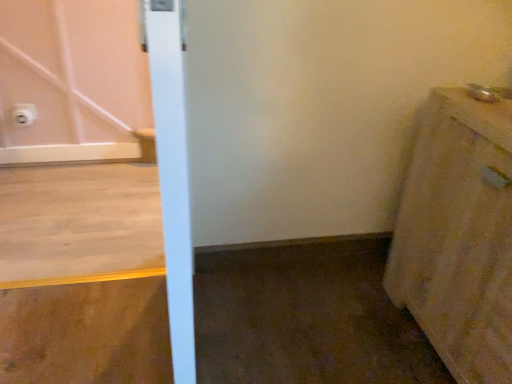
The width and height of the screenshot is (512, 384). What are the coordinates of `white plastic electric outlet at upper left` in the screenshot? It's located at (24, 114).

The height and width of the screenshot is (384, 512). What do you see at coordinates (24, 114) in the screenshot?
I see `white plastic electric outlet at upper left` at bounding box center [24, 114].

What do you see at coordinates (458, 235) in the screenshot? I see `beige fabric cabinet at right` at bounding box center [458, 235].

Where is `beige fabric cabinet at right`? The width and height of the screenshot is (512, 384). beige fabric cabinet at right is located at coordinates (458, 235).

Locate an element on the screen. This screenshot has width=512, height=384. white plastic electric outlet at upper left is located at coordinates (24, 114).

Does beige fabric cabinet at right appear on the left side of white plastic electric outlet at upper left?

Incorrect, beige fabric cabinet at right is not on the left side of white plastic electric outlet at upper left.

Is beige fabric cabinet at right further to the viewer compared to white plastic electric outlet at upper left?

No, it is not.

Does point (502, 228) appear closer or farther from the camera than point (31, 108)?

Point (502, 228).

From the image's perspective, is beige fabric cabinet at right positioned above or below white plastic electric outlet at upper left?

Based on their image positions, beige fabric cabinet at right is located beneath white plastic electric outlet at upper left.

From a real-world perspective, which is physically above, beige fabric cabinet at right or white plastic electric outlet at upper left?

From a 3D spatial view, beige fabric cabinet at right is above.

Between beige fabric cabinet at right and white plastic electric outlet at upper left, which one has smaller width?

white plastic electric outlet at upper left.

Considering the sizes of objects beige fabric cabinet at right and white plastic electric outlet at upper left in the image provided, who is taller, beige fabric cabinet at right or white plastic electric outlet at upper left?

beige fabric cabinet at right is taller.

Is beige fabric cabinet at right bigger than white plastic electric outlet at upper left?

Indeed, beige fabric cabinet at right has a larger size compared to white plastic electric outlet at upper left.

Is beige fabric cabinet at right completely or partially outside of white plastic electric outlet at upper left?

Yes, beige fabric cabinet at right is located beyond the bounds of white plastic electric outlet at upper left.

Is beige fabric cabinet at right not close to white plastic electric outlet at upper left?

beige fabric cabinet at right is positioned a significant distance from white plastic electric outlet at upper left.

Is white plastic electric outlet at upper left at the back of beige fabric cabinet at right?

beige fabric cabinet at right does not have its back to white plastic electric outlet at upper left.

How different are the orientations of beige fabric cabinet at right and white plastic electric outlet at upper left in degrees?

They differ by 89.1 degrees in their facing directions.

Identify the location of cabinetry located below the white plastic electric outlet at upper left (from the image's perspective). (458, 235).

Between white plastic electric outlet at upper left and beige fabric cabinet at right, which one appears on the left side from the viewer's perspective?

white plastic electric outlet at upper left is more to the left.

In the scene shown: Is white plastic electric outlet at upper left positioned before beige fabric cabinet at right?

No, it is not.

Which is closer, (30, 116) or (417, 220)?

Point (30, 116).

From the image's perspective, would you say white plastic electric outlet at upper left is shown under beige fabric cabinet at right?

No.

Looking at this image, from a real-world perspective, is white plastic electric outlet at upper left under beige fabric cabinet at right?

Indeed, from a real-world perspective, white plastic electric outlet at upper left is positioned beneath beige fabric cabinet at right.

Which of these two, white plastic electric outlet at upper left or beige fabric cabinet at right, is wider?

beige fabric cabinet at right.

Can you confirm if white plastic electric outlet at upper left is taller than beige fabric cabinet at right?

In fact, white plastic electric outlet at upper left may be shorter than beige fabric cabinet at right.

Considering the sizes of white plastic electric outlet at upper left and beige fabric cabinet at right in the image, is white plastic electric outlet at upper left bigger or smaller than beige fabric cabinet at right?

In the image, white plastic electric outlet at upper left appears to be smaller than beige fabric cabinet at right.

Based on the photo, is white plastic electric outlet at upper left surrounding beige fabric cabinet at right?

That's incorrect, beige fabric cabinet at right is not inside white plastic electric outlet at upper left.

Is white plastic electric outlet at upper left far away from beige fabric cabinet at right?

Absolutely, white plastic electric outlet at upper left is distant from beige fabric cabinet at right.

Is white plastic electric outlet at upper left oriented away from beige fabric cabinet at right?

No, white plastic electric outlet at upper left's orientation is not away from beige fabric cabinet at right.

What's the angular difference between white plastic electric outlet at upper left and beige fabric cabinet at right's facing directions?

There is a 89.1-degree angle between the facing directions of white plastic electric outlet at upper left and beige fabric cabinet at right.

Locate an element on the screen. This screenshot has height=384, width=512. cabinetry in front of the white plastic electric outlet at upper left is located at coordinates pyautogui.click(x=458, y=235).

You are a GUI agent. You are given a task and a screenshot of the screen. Output one action in this format:
    pyautogui.click(x=<x>, y=<y>)
    Task: Click on the cabinetry that is on the right side of white plastic electric outlet at upper left
    
    Given the screenshot: What is the action you would take?
    pyautogui.click(x=458, y=235)

I want to click on cabinetry above the white plastic electric outlet at upper left (from a real-world perspective), so click(x=458, y=235).